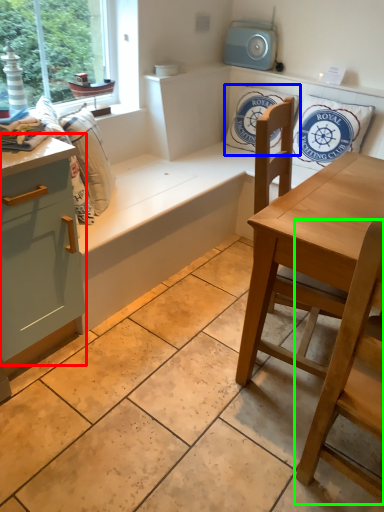
Question: Based on their relative distances, which object is farther from cabinetry (highlighted by a red box)? Choose from pillow (highlighted by a blue box) and chair (highlighted by a green box).

Choices:
 (A) pillow
 (B) chair

Answer: (A)